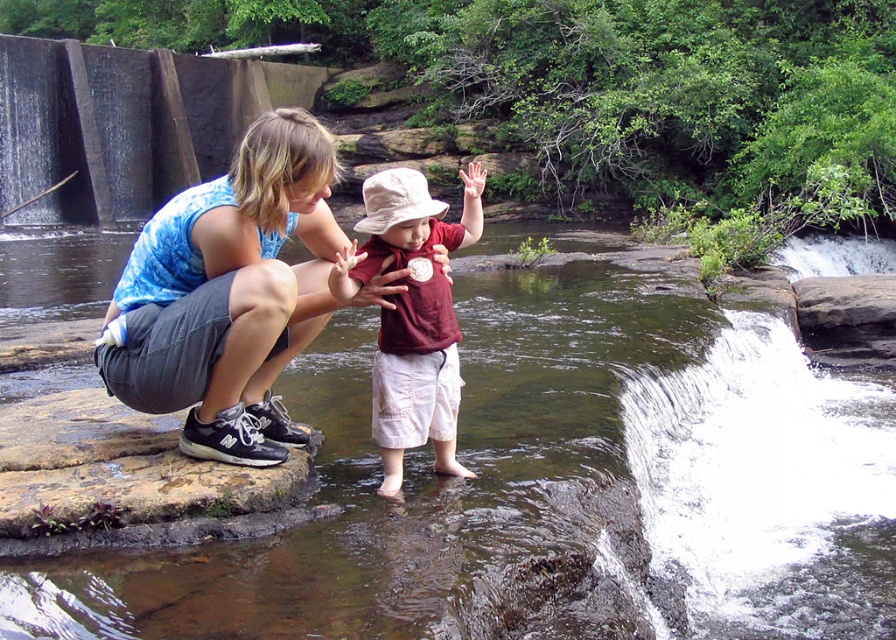
Which is in front, point (724, 577) or point (698, 378)?

Point (724, 577) is more forward.

Does clear water at creek center appear on the right side of white frothy water at lower right?

Incorrect, clear water at creek center is not on the right side of white frothy water at lower right.

Between point (660, 488) and point (869, 554), which one is positioned in front?

Positioned in front is point (660, 488).

Locate an element on the screen. clear water at creek center is located at coordinates (549, 492).

Who is more distant from viewer, (346, 442) or (136, 403)?

Point (346, 442)

How distant is clear water at creek center from blue tie-dye tank top at center?

The distance of clear water at creek center from blue tie-dye tank top at center is 5.16 meters.

I want to click on clear water at creek center, so click(x=549, y=492).

Can you confirm if white frothy water at lower right is taller than blue tie-dye tank top at center?

In fact, white frothy water at lower right may be shorter than blue tie-dye tank top at center.

Which of these two, white frothy water at lower right or blue tie-dye tank top at center, stands taller?

With more height is blue tie-dye tank top at center.

Locate an element on the screen. white frothy water at lower right is located at coordinates [764, 492].